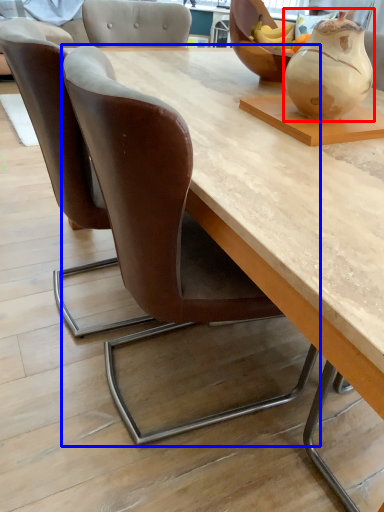
Question: Among these objects, which one is farthest to the camera, vase (highlighted by a red box) or chair (highlighted by a blue box)?

Choices:
 (A) vase
 (B) chair

Answer: (A)